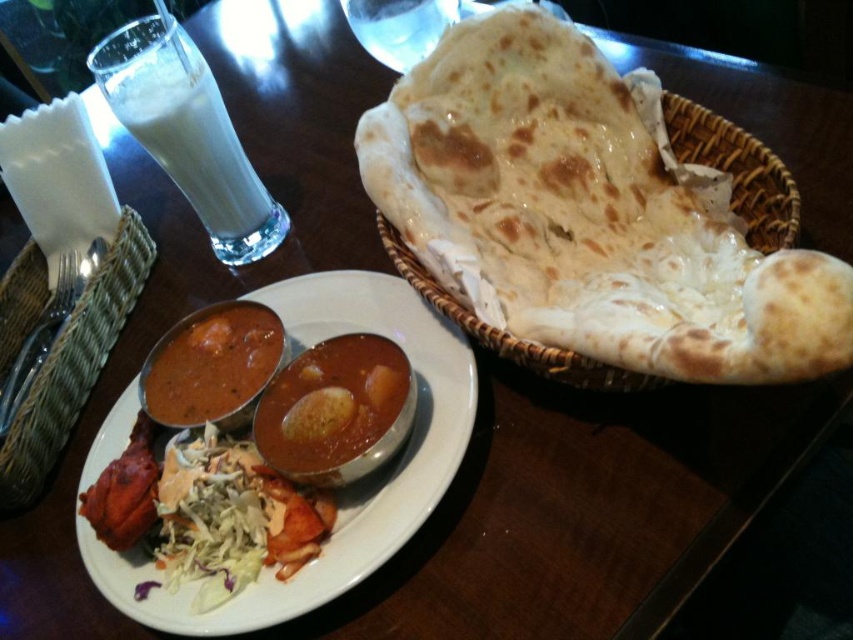
Question: Considering the relative positions of white ceramic plate at center and smokey brown matte curry at center in the image provided, where is white ceramic plate at center located with respect to smokey brown matte curry at center?

Choices:
 (A) above
 (B) below

Answer: (B)

Question: Which object is positioned farthest from the brown woven basket at upper right?

Choices:
 (A) smooth brown curry at center
 (B) smokey brown matte curry at center
 (C) white frothy milk at upper left

Answer: (C)

Question: Does white ceramic plate at center come in front of brown woven basket at upper right?

Choices:
 (A) no
 (B) yes

Answer: (A)

Question: Which of the following is the farthest from the observer?

Choices:
 (A) white frothy milk at upper left
 (B) matte brown basket at center

Answer: (A)

Question: Can you confirm if matte brown basket at center is positioned below brown woven basket at upper right?

Choices:
 (A) yes
 (B) no

Answer: (A)

Question: Estimate the real-world distances between objects in this image. Which object is closer to the smokey brown matte curry at center?

Choices:
 (A) white ceramic plate at center
 (B) brown woven basket at upper right
 (C) white frothy milk at upper left

Answer: (A)